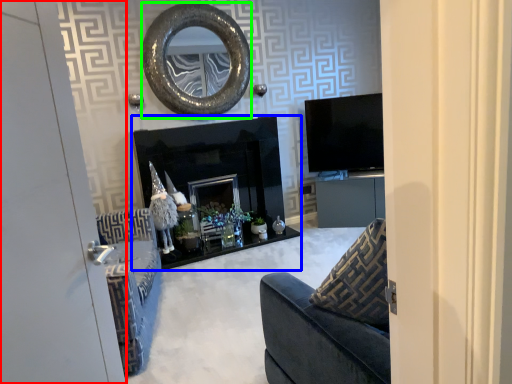
Question: Which is farther away from door (highlighted by a red box)? fireplace (highlighted by a blue box) or oval (highlighted by a green box)?

Choices:
 (A) fireplace
 (B) oval

Answer: (B)